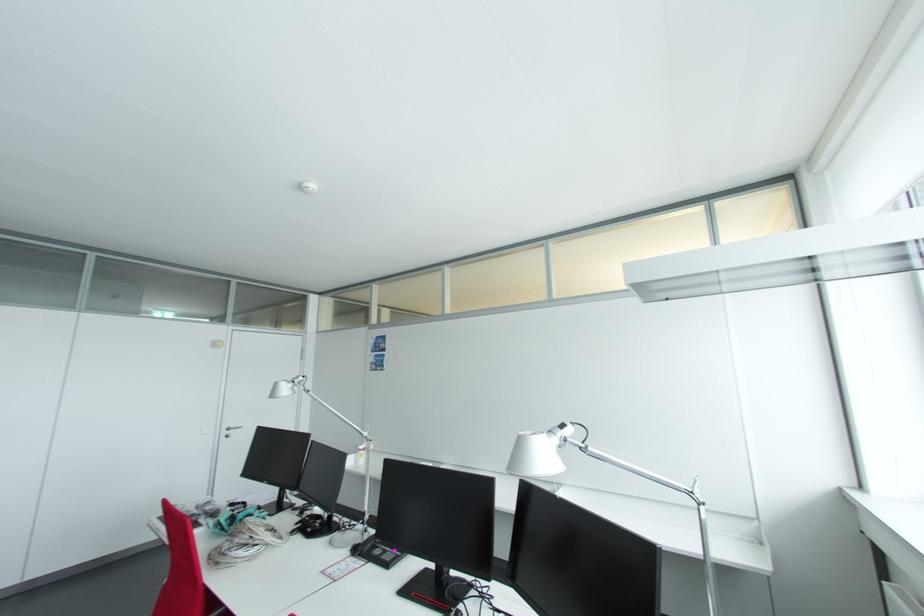
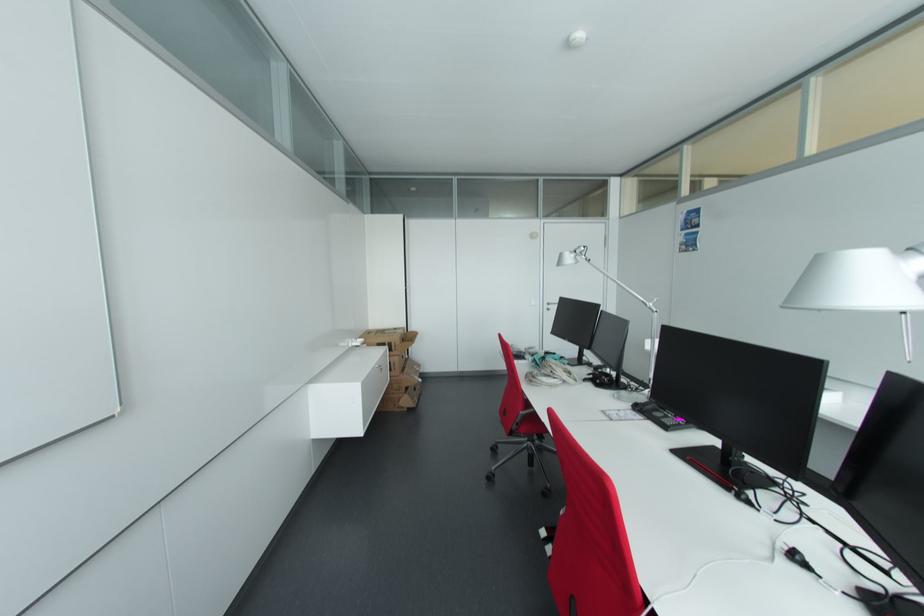
Find the pixel in the second image that matches pixel 386 557 in the first image.

(666, 421)